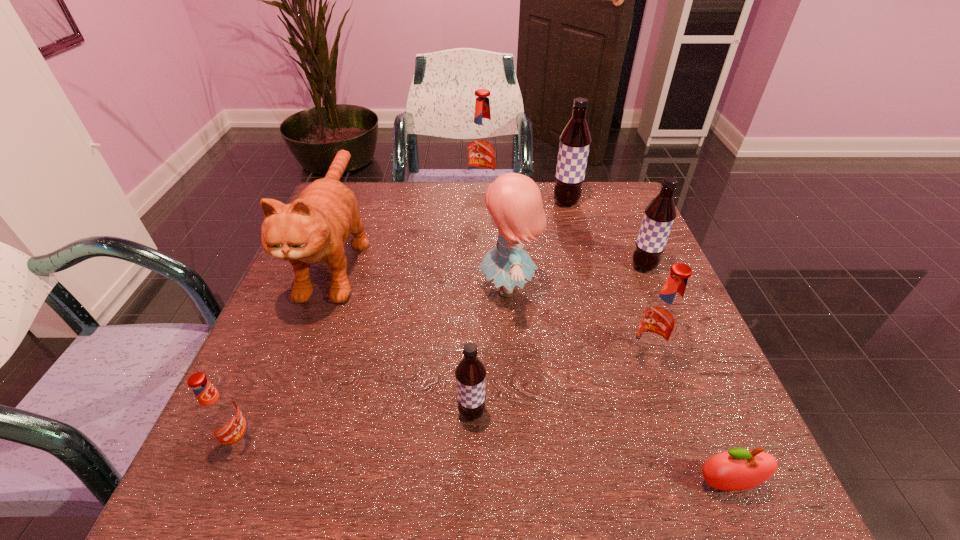
Find the location of a particular element. This screenshot has height=540, width=960. cat located in the left edge section of the desktop is located at coordinates (316, 226).

Where is `root beer present at the left edge`? This screenshot has height=540, width=960. root beer present at the left edge is located at coordinates (220, 414).

This screenshot has height=540, width=960. What are the coordinates of `apple present at the right edge` in the screenshot? It's located at (737, 469).

Locate an element on the screen. The height and width of the screenshot is (540, 960). object at the far left corner is located at coordinates (316, 226).

I want to click on object that is at the near left corner, so click(220, 414).

Where is `object situated at the far right corner`? The width and height of the screenshot is (960, 540). object situated at the far right corner is located at coordinates (575, 140).

Image resolution: width=960 pixels, height=540 pixels. I want to click on object that is at the near right corner, so click(737, 469).

The width and height of the screenshot is (960, 540). Find the location of `free region at the far edge of the desktop`. free region at the far edge of the desktop is located at coordinates (474, 210).

What are the coordinates of `vacant region at the near edge of the desktop` in the screenshot? It's located at [509, 503].

Locate an element on the screen. vacant area at the left edge is located at coordinates (271, 426).